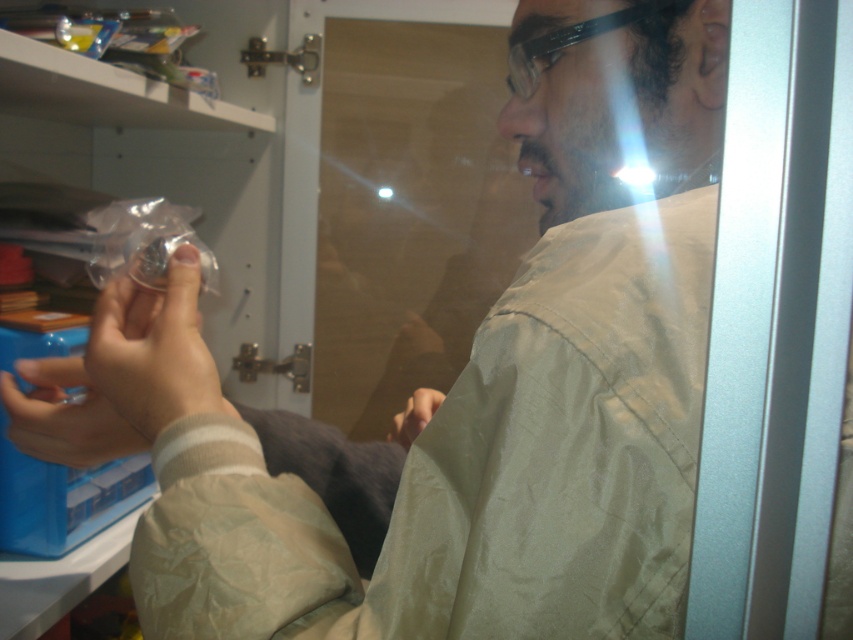
You are a photographer adjusting your camera settings to capture a clear image of two points in the scene. The points are located at coordinates point [152,422] and point [16,426]. Which point should you focus on first to ensure it appears sharp in the foreground?

Point [152,422] should be focused on first because it is closer to the camera than point [16,426], making it the foreground element.